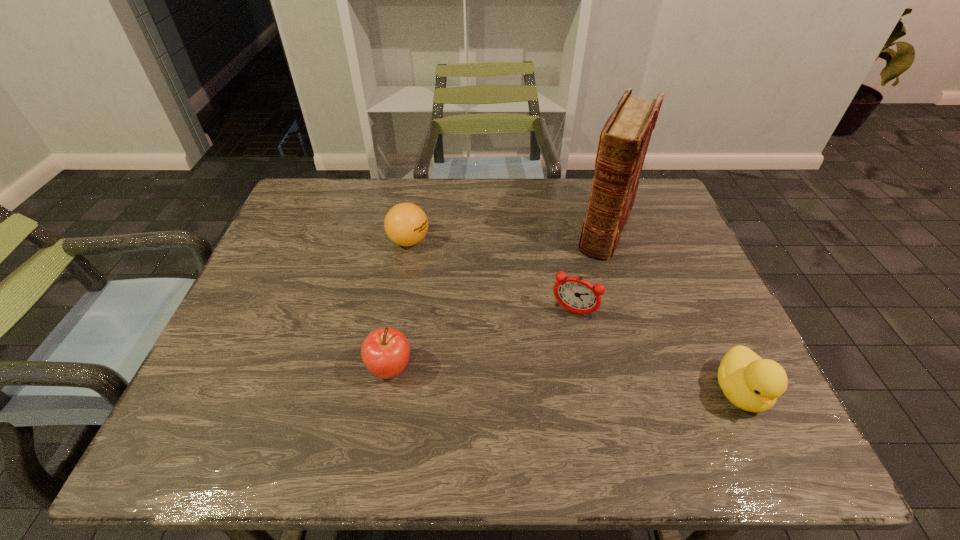
The image size is (960, 540). Find the location of `free space on the desktop that is between the apple and the duck and is positioned on the side with brand of the ping-pong ball`. free space on the desktop that is between the apple and the duck and is positioned on the side with brand of the ping-pong ball is located at coordinates (568, 381).

Identify the location of vacant space on the desktop that is between the apple and the duck and is positioned on the spine side of the hardback book. (539, 379).

This screenshot has width=960, height=540. In order to click on vacant space on the desktop that is between the apple and the rightmost object and is positioned on the front-facing side of the alarm clock in this screenshot , I will do tap(544, 379).